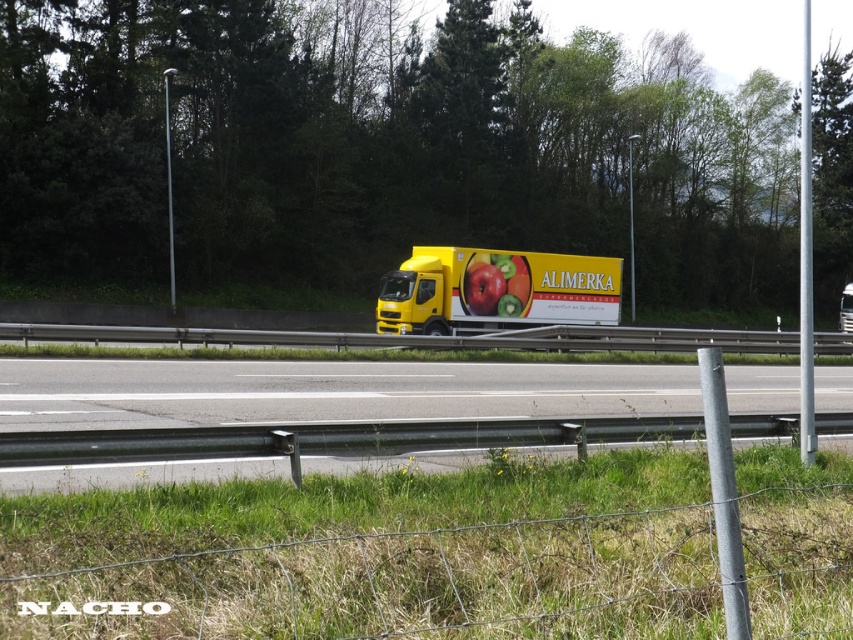
You are a delivery driver who needs to park your vehicle in a parking spot that can only accommodate vehicles up to 10 meters in length. You observe the yellow matte truck at center and the yellow matte trailer truck at center in the image. Which vehicle should you choose to park in the spot?

The yellow matte truck at center is shorter than the yellow matte trailer truck at center, so you should choose the yellow matte truck at center to park in the spot since it is shorter and more likely to fit within the 10 meter limit.

You are a delivery driver who needs to know if your truck will fit through a narrow tunnel. The tunnel has a width limit that only allows vehicles narrower than the shiny red apple at center. Can your yellow matte trailer truck at center pass through the tunnel?

The yellow matte trailer truck at center is wider than the shiny red apple at center, so it cannot pass through the tunnel which has a width limit narrower than the apple.

You are standing at the point labeled as point (607,307) and want to walk to the point labeled as point (817,365). Which direction should you move to get closer to your destination?

To move from point (607,307) to point (817,365), you should move towards the direction of the yellow truck since point (817,365) is closer to the viewer than point (607,307).